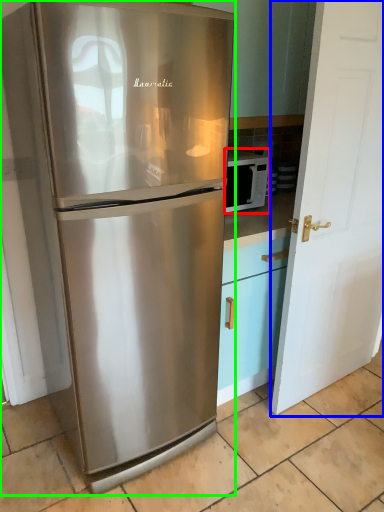
Question: Which object is positioned farthest from microwave oven (highlighted by a red box)? Select from door (highlighted by a blue box) and refrigerator (highlighted by a green box).

Choices:
 (A) door
 (B) refrigerator

Answer: (B)